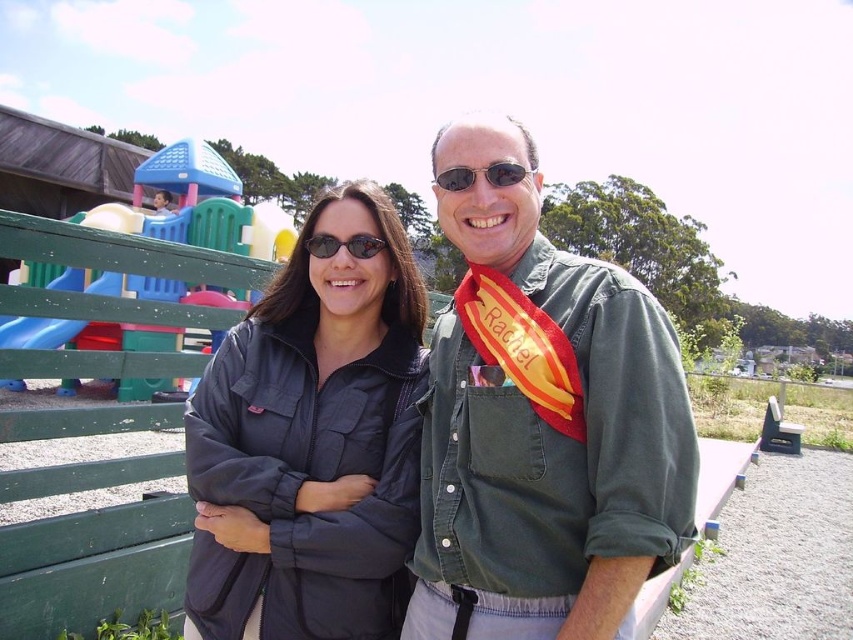
You are a photographer trying to capture a clear photo of the sunglasses at center without the green denim shirt at center blocking it. What should you do?

The green denim shirt at center is in front of sunglasses at center, so you should move the green denim shirt at center out of the way or adjust your angle to avoid the obstruction.

You are a photographer planning to take a group photo of the two people in the park. You need to ensure that both the matte black jacket at center and the sunglasses at center are clearly visible in the photo. Given that your camera has a minimum focus distance of 1 meter, will you be able to capture both objects in focus at the same time?

The matte black jacket at center and sunglasses at center are 1.09 meters apart. Since the camera requires a minimum focus distance of 1 meter, the 1.09 meters distance between them is slightly beyond the minimum requirement. Therefore, both objects can be captured in focus simultaneously.